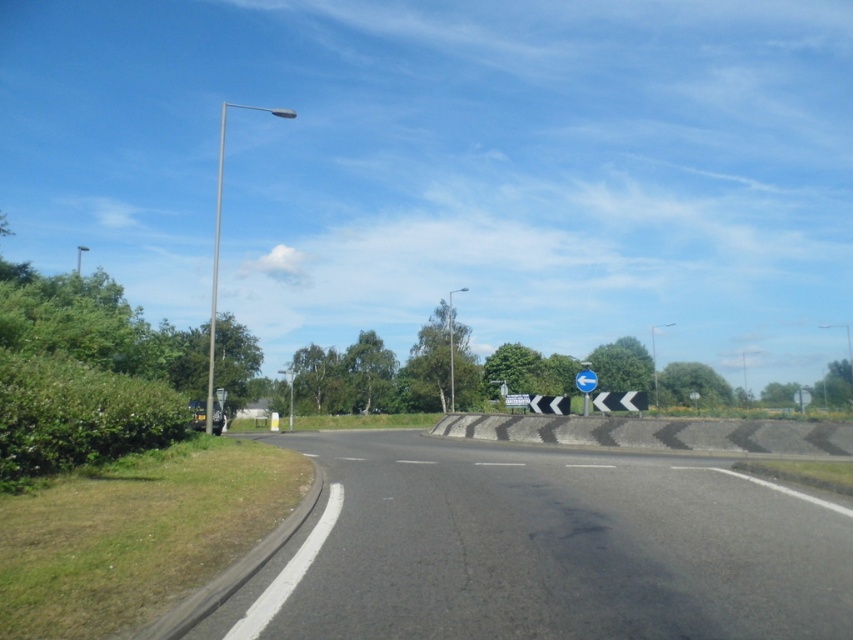
You are driving a car and see the black asphalt highway at lower left and the blue glossy sign at center. Which one is narrower in width?

The black asphalt highway at lower left has a lesser width compared to the blue glossy sign at center, so the black asphalt highway at lower left is narrower.

You are driving a car and see the black asphalt barrier at center and the metallic pole at left. Which object is closer to your left side as you drive along the road?

The metallic pole at left is closer to your left side as you drive because it is positioned to the left of the black asphalt barrier at center.

You are a delivery driver approaching the black asphalt highway at lower left and the blue plastic sign at center. Which object will appear closer to you as you drive forward?

The black asphalt highway at lower left will appear closer because it is shorter than the blue plastic sign at center, making it seem nearer from your perspective.